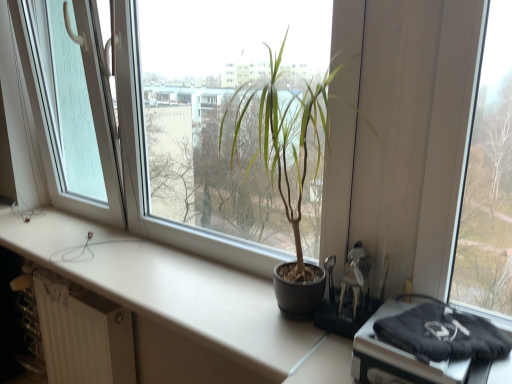
Measure the distance between point (50,268) and camera.

The depth of point (50,268) is 1.37 meters.

Where is `white textured radiator at lower left`? white textured radiator at lower left is located at coordinates (83, 333).

The image size is (512, 384). Describe the element at coordinates (288, 167) in the screenshot. I see `matte black pot at center` at that location.

This screenshot has height=384, width=512. What do you see at coordinates (51, 150) in the screenshot?
I see `transparent glass door at left` at bounding box center [51, 150].

Find the location of `white matte counter top at center`. white matte counter top at center is located at coordinates (184, 303).

Is point (108, 223) behind point (142, 326)?

Yes, point (108, 223) is behind point (142, 326).

Relative to white matte counter top at center, is transparent glass door at left in front or behind?

Visually, transparent glass door at left is located behind white matte counter top at center.

In the scene shown: Is transparent glass door at left taller than white matte counter top at center?

Yes, transparent glass door at left is taller than white matte counter top at center.

Is transparent glass door at left looking in the opposite direction of white matte counter top at center?

No.

Are white textured radiator at lower left and transparent glass door at left far apart?

No.

Locate an element on the screen. Image resolution: width=512 pixels, height=384 pixels. radiator below the transparent glass door at left (from the image's perspective) is located at coordinates (83, 333).

Which object is more forward, white textured radiator at lower left or transparent glass door at left?

transparent glass door at left is in front.

In terms of width, does white textured radiator at lower left look wider or thinner when compared to transparent glass door at left?

Clearly, white textured radiator at lower left has less width compared to transparent glass door at left.

Which of these two, white matte counter top at center or transparent glass door at left, is wider?

With larger width is white matte counter top at center.

Which is more to the left, white matte counter top at center or transparent glass door at left?

From the viewer's perspective, transparent glass door at left appears more on the left side.

Considering the sizes of objects white matte counter top at center and transparent glass door at left in the image provided, who is bigger, white matte counter top at center or transparent glass door at left?

transparent glass door at left.

Can we say white matte counter top at center lies outside transparent glass door at left?

Indeed, white matte counter top at center is completely outside transparent glass door at left.

Which is further, (298, 338) or (218, 141)?

The point (218, 141) is farther from the camera.

From the image's perspective, which object appears higher, white matte counter top at center or matte black pot at center?

From the image's view, matte black pot at center is above.

Considering the relative sizes of white matte counter top at center and matte black pot at center in the image provided, is white matte counter top at center thinner than matte black pot at center?

In fact, white matte counter top at center might be wider than matte black pot at center.

Which object is positioned more to the left, white matte counter top at center or matte black pot at center?

white matte counter top at center is more to the left.

Can you confirm if transparent glass door at left is wider than matte black pot at center?

No, transparent glass door at left is not wider than matte black pot at center.

From a real-world perspective, which is physically above, transparent glass door at left or matte black pot at center?

transparent glass door at left.

Does transparent glass door at left appear on the left side of matte black pot at center?

Yes.

Is white textured radiator at lower left positioned with its back to matte black pot at center?

white textured radiator at lower left does not have its back to matte black pot at center.

Is point (58, 382) less distant than point (286, 123)?

No, (58, 382) is further to viewer.

Visually, is white matte counter top at center positioned to the left or to the right of white textured radiator at lower left?

From the image, it's evident that white matte counter top at center is to the right of white textured radiator at lower left.

Is point (336, 355) in front of point (58, 290)?

That is True.

In the scene shown: Between white matte counter top at center and white textured radiator at lower left, which one is positioned behind?

Positioned behind is white textured radiator at lower left.

What's the angular difference between white matte counter top at center and white textured radiator at lower left's facing directions?

The angular difference between white matte counter top at center and white textured radiator at lower left is 0.957 degrees.

At what (x,y) coordinates should I click in order to perform the action: click on glass door behind the white matte counter top at center. Please return your answer as a coordinate pair (x, y). Looking at the image, I should click on (51, 150).

Where is `radiator below the transparent glass door at left (from the image's perspective)`? This screenshot has width=512, height=384. radiator below the transparent glass door at left (from the image's perspective) is located at coordinates (83, 333).

From the image, which object appears to be farther from white matte counter top at center, matte black pot at center or white textured radiator at lower left?

Based on the image, matte black pot at center appears to be further to white matte counter top at center.

Estimate the real-world distances between objects in this image. Which object is further from white matte counter top at center, matte black pot at center or transparent glass door at left?

Based on the image, matte black pot at center appears to be further to white matte counter top at center.

From the image, which object appears to be nearer to white textured radiator at lower left, transparent glass door at left or white matte counter top at center?

white matte counter top at center is closer to white textured radiator at lower left.

Which object lies nearer to the anchor point white matte counter top at center, white textured radiator at lower left or transparent glass door at left?

Among the two, white textured radiator at lower left is located nearer to white matte counter top at center.

Based on the photo, estimate the real-world distances between objects in this image. Which object is closer to transparent glass door at left, white textured radiator at lower left or white matte counter top at center?

white matte counter top at center lies closer to transparent glass door at left than the other object.

From the image, which object appears to be farther from white matte counter top at center, transparent glass door at left or matte black pot at center?

matte black pot at center is further to white matte counter top at center.

Estimate the real-world distances between objects in this image. Which object is closer to transparent glass door at left, white textured radiator at lower left or matte black pot at center?

white textured radiator at lower left is positioned closer to the anchor transparent glass door at left.

Looking at the image, which one is located closer to white textured radiator at lower left, white matte counter top at center or transparent glass door at left?

Based on the image, white matte counter top at center appears to be nearer to white textured radiator at lower left.

Where is `radiator located between transparent glass door at left and matte black pot at center in the left-right direction`? Image resolution: width=512 pixels, height=384 pixels. radiator located between transparent glass door at left and matte black pot at center in the left-right direction is located at coordinates (83, 333).

Locate an element on the screen. This screenshot has height=384, width=512. counter top between white textured radiator at lower left and matte black pot at center in the horizontal direction is located at coordinates (184, 303).

The image size is (512, 384). In order to click on counter top that lies between transparent glass door at left and white textured radiator at lower left from top to bottom in this screenshot , I will do `click(184, 303)`.

I want to click on counter top between transparent glass door at left and matte black pot at center from left to right, so click(184, 303).